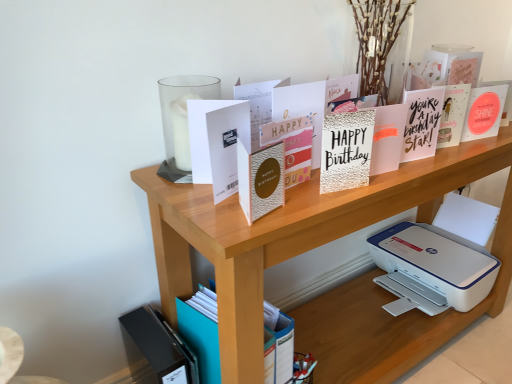
Question: Is point (330, 309) positioned closer to the camera than point (246, 97)?

Choices:
 (A) closer
 (B) farther

Answer: (B)

Question: Is wooden shelf at upper center wider or thinner than white matte card at center, acting as the 7th paperback book starting from the right?

Choices:
 (A) thin
 (B) wide

Answer: (B)

Question: Which is farther from the black matte journal at lower left?

Choices:
 (A) matte white card at upper right, the first paperback book when ordered from right to left
 (B) wooden shelf at upper center
 (C) silver glitter card at center, the 6th paperback book when ordered from left to right
 (D) matte gold card at center, which appears as the 3th paperback book when viewed from the left
 (E) metallic gold card at upper center

Answer: (A)

Question: Estimate the real-world distances between objects in this image. Which object is closer to the black matte journal at lower left?

Choices:
 (A) white matte card at upper center, acting as the 8th paperback book starting from the right
 (B) wooden shelf at upper center
 (C) matte gold card at center, which is the 6th paperback book in right-to-left order
 (D) matte white card at upper right, the first paperback book when ordered from right to left
 (E) white textured card at center, which is counted as the seventh paperback book, starting from the left

Answer: (B)